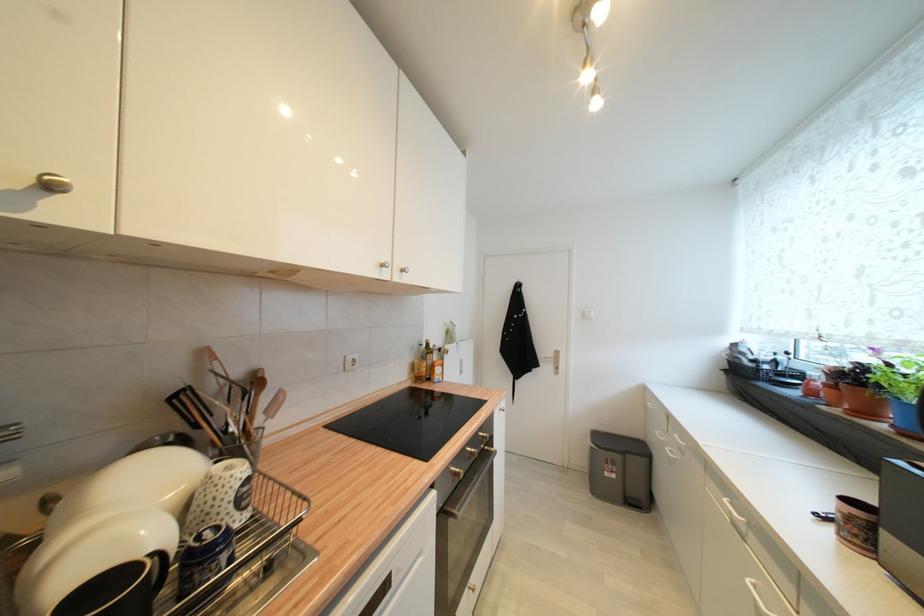
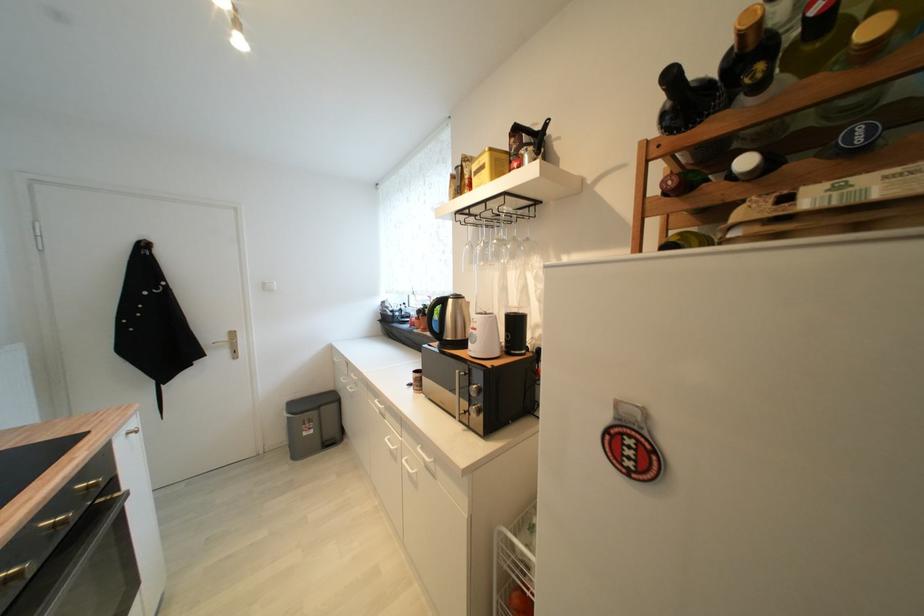
Question: The camera is either moving clockwise (left) or counter-clockwise (right) around the object. The first image is from the beginning of the video and the second image is from the end. Is the camera moving left or right when shooting the video?

Choices:
 (A) Left
 (B) Right

Answer: (A)